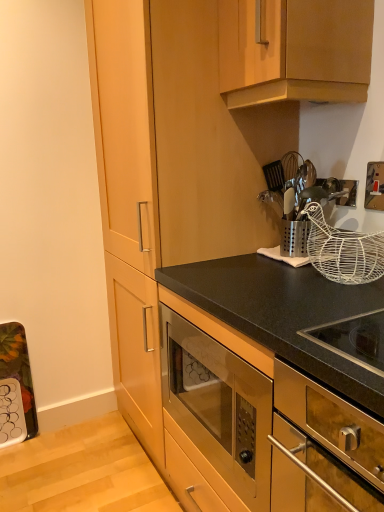
Question: Would you say wooden cabinet at upper center, positioned as the 1th cabinetry in top-to-bottom order, is inside or outside gold metallic switch at upper right?

Choices:
 (A) inside
 (B) outside

Answer: (B)

Question: From a real-world perspective, relative to gold metallic switch at upper right, is wooden cabinet at upper center, the 2th cabinetry ordered from the bottom, vertically above or below?

Choices:
 (A) above
 (B) below

Answer: (A)

Question: Which is nearer to the gold metallic switch at upper right?

Choices:
 (A) metallic silver utensil holder at upper right
 (B) stainless steel oven at lower right
 (C) white wire basket at upper right
 (D) wooden cabinet at upper center, the 2th cabinetry ordered from the bottom
 (E) stainless steel oven at center, placed as the 1th cabinetry when sorted from bottom to top

Answer: (A)

Question: Estimate the real-world distances between objects in this image. Which object is closer to the white wire basket at upper right?

Choices:
 (A) gold metallic switch at upper right
 (B) stainless steel oven at lower right
 (C) metallic silver utensil holder at upper right
 (D) stainless steel oven at center, placed as the 1th cabinetry when sorted from bottom to top
 (E) wooden cabinet at upper center, positioned as the 1th cabinetry in top-to-bottom order

Answer: (C)